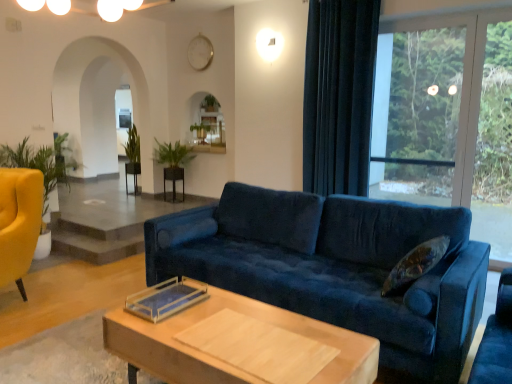
Question: Considering the relative sizes of silver metallic clock at upper center and green leafy plant at center, which appears as the 2th plant when viewed from the left, in the image provided, is silver metallic clock at upper center wider than green leafy plant at center, which appears as the 2th plant when viewed from the left,?

Choices:
 (A) no
 (B) yes

Answer: (A)

Question: From a real-world perspective, is silver metallic clock at upper center below green leafy plant at center, the 1th plant when ordered from right to left?

Choices:
 (A) no
 (B) yes

Answer: (A)

Question: From the image's perspective, would you say silver metallic clock at upper center is shown under green leafy plant at center, the 1th plant when ordered from right to left?

Choices:
 (A) yes
 (B) no

Answer: (B)

Question: Is silver metallic clock at upper center closer to camera compared to green leafy plant at center, which appears as the 2th plant when viewed from the left?

Choices:
 (A) no
 (B) yes

Answer: (A)

Question: Is silver metallic clock at upper center next to green leafy plant at center, which appears as the 2th plant when viewed from the left?

Choices:
 (A) no
 (B) yes

Answer: (A)

Question: Can you confirm if silver metallic clock at upper center is positioned to the right of green leafy plant at center, which is the first plant from front to back?

Choices:
 (A) no
 (B) yes

Answer: (B)

Question: Can you confirm if light wood/wooden coffee table at center is smaller than transparent glass window at upper right?

Choices:
 (A) no
 (B) yes

Answer: (A)

Question: From a real-world perspective, is light wood/wooden coffee table at center physically above transparent glass window at upper right?

Choices:
 (A) no
 (B) yes

Answer: (A)

Question: Is light wood/wooden coffee table at center located outside transparent glass window at upper right?

Choices:
 (A) no
 (B) yes

Answer: (B)

Question: Is transparent glass window at upper right a part of light wood/wooden coffee table at center?

Choices:
 (A) no
 (B) yes

Answer: (A)

Question: Considering the relative sizes of light wood/wooden coffee table at center and transparent glass window at upper right in the image provided, is light wood/wooden coffee table at center taller than transparent glass window at upper right?

Choices:
 (A) no
 (B) yes

Answer: (A)

Question: Considering the relative positions of light wood/wooden coffee table at center and transparent glass window at upper right in the image provided, is light wood/wooden coffee table at center in front of transparent glass window at upper right?

Choices:
 (A) yes
 (B) no

Answer: (A)

Question: Considering the relative sizes of transparent glass window at upper right and green leafy plant at center, arranged as the first plant when viewed from the back, in the image provided, is transparent glass window at upper right smaller than green leafy plant at center, arranged as the first plant when viewed from the back,?

Choices:
 (A) yes
 (B) no

Answer: (B)